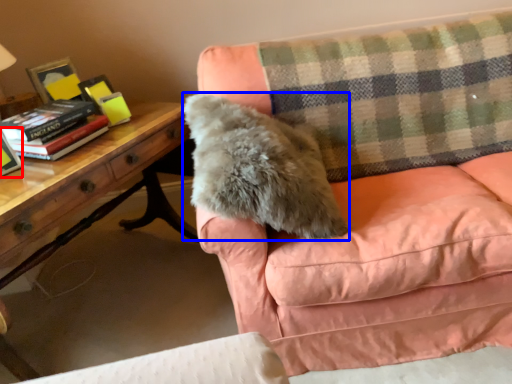
Question: Among these objects, which one is farthest to the camera, paperback book (highlighted by a red box) or throw pillow (highlighted by a blue box)?

Choices:
 (A) paperback book
 (B) throw pillow

Answer: (A)